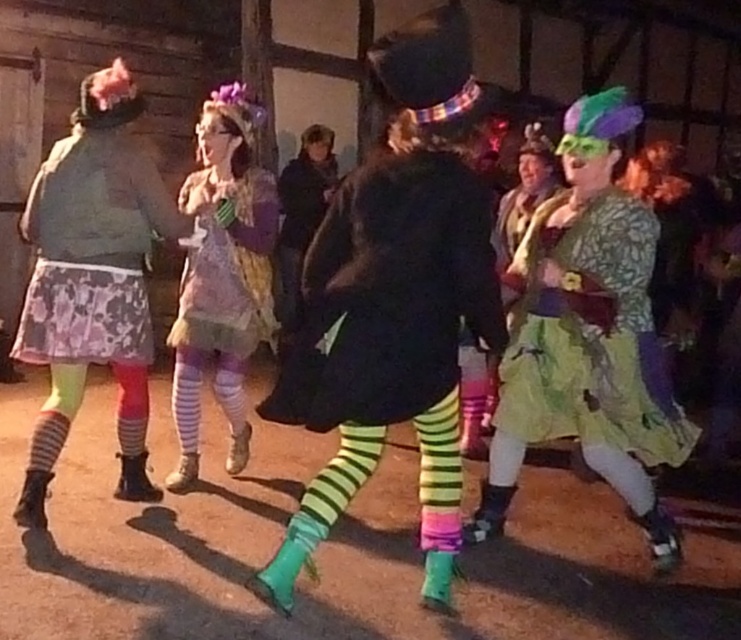
Question: Does matte black coat at center have a larger size compared to matte purple dress at center?

Choices:
 (A) no
 (B) yes

Answer: (B)

Question: Is matte purple dress at center in front of pastel floral dress at center?

Choices:
 (A) yes
 (B) no

Answer: (A)

Question: Which object appears closest to the camera in this image?

Choices:
 (A) matte purple dress at center
 (B) pastel floral dress at center
 (C) green floral dress at center
 (D) matte black coat at center

Answer: (D)

Question: Among these points, which one is nearest to the camera?

Choices:
 (A) pyautogui.click(x=272, y=227)
 (B) pyautogui.click(x=614, y=435)
 (C) pyautogui.click(x=425, y=547)

Answer: (C)

Question: Is green floral dress at center thinner than pastel floral dress at center?

Choices:
 (A) no
 (B) yes

Answer: (A)

Question: Based on their relative distances, which object is nearer to the green floral dress at center?

Choices:
 (A) matte purple dress at center
 (B) pastel floral dress at center

Answer: (B)